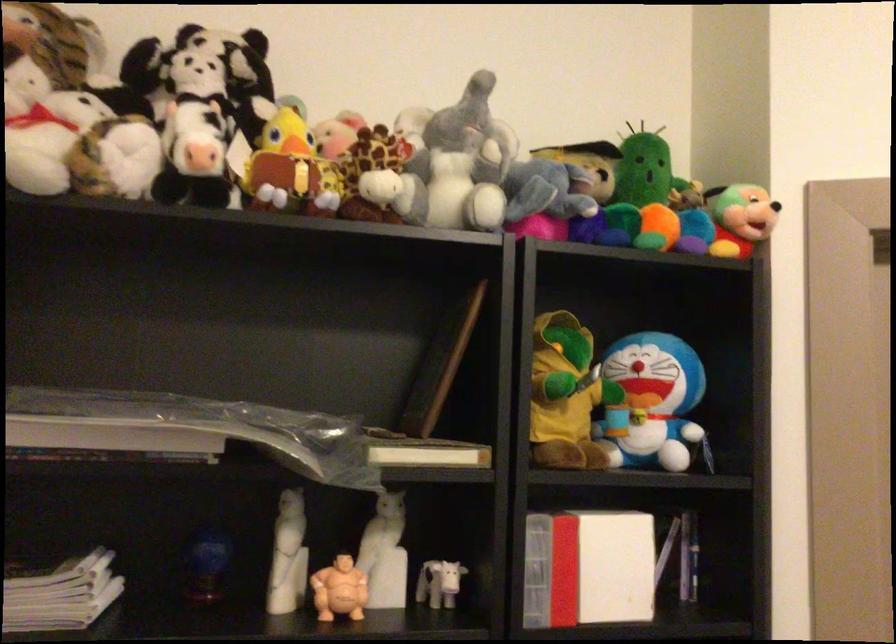
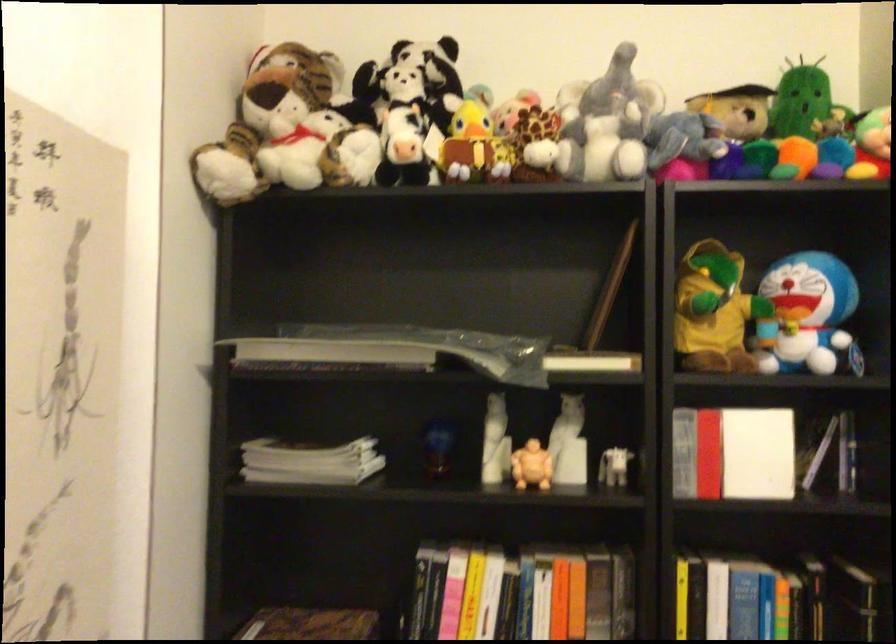
Where in the second image is the point corresponding to (209,73) from the first image?

(410, 79)